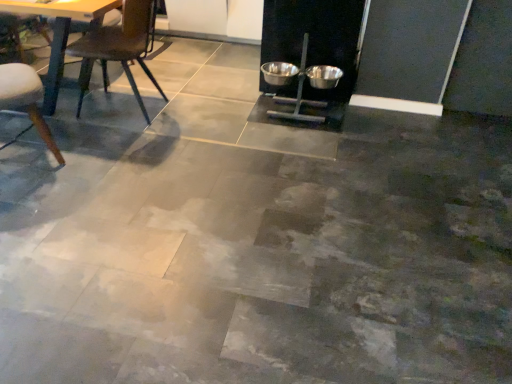
Question: Considering the relative positions of metallic bowls at center, placed as the first bowl when sorted from left to right, and wooden chair at left, the second chair when ordered from right to left, in the image provided, is metallic bowls at center, placed as the first bowl when sorted from left to right, to the left or to the right of wooden chair at left, the second chair when ordered from right to left,?

Choices:
 (A) left
 (B) right

Answer: (B)

Question: Choose the correct answer: Is metallic bowls at center, the second bowl in the right-to-left sequence, inside wooden chair at left, the first chair positioned from the left, or outside it?

Choices:
 (A) inside
 (B) outside

Answer: (B)

Question: Estimate the real-world distances between objects in this image. Which object is closer to the metallic silver bowl at center-right, the 2th bowl viewed from the left?

Choices:
 (A) metallic dark brown chair at left, the first chair positioned from the right
 (B) metallic bowls at center, placed as the first bowl when sorted from left to right
 (C) wooden chair at left, the first chair positioned from the left

Answer: (B)

Question: Estimate the real-world distances between objects in this image. Which object is closer to the metallic dark brown chair at left, positioned as the 2th chair in left-to-right order?

Choices:
 (A) metallic silver bowl at center-right, the 1th bowl from the right
 (B) metallic bowls at center, placed as the first bowl when sorted from left to right
 (C) wooden chair at left, the second chair when ordered from right to left

Answer: (C)